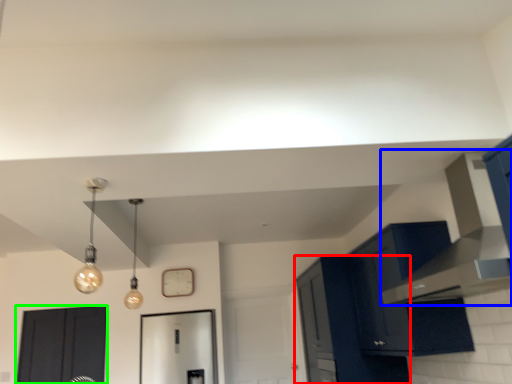
Question: Which object is positioned closest to cabinetry (highlighted by a red box)? Select from vent (highlighted by a blue box) and door (highlighted by a green box).

Choices:
 (A) vent
 (B) door

Answer: (A)